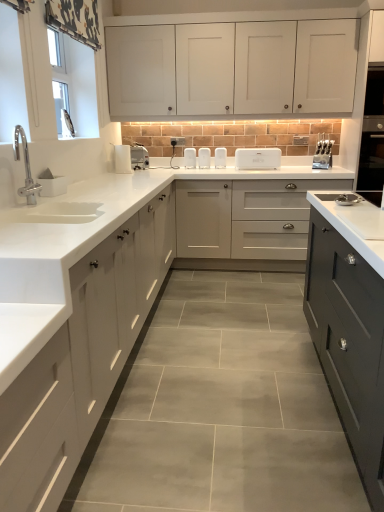
Describe the element at coordinates (323, 153) in the screenshot. This screenshot has width=384, height=512. I see `satin silver knife block at right, positioned as the third appliance in front-to-back order` at that location.

This screenshot has height=512, width=384. What do you see at coordinates (190, 158) in the screenshot?
I see `white glossy toaster at center, marked as the 4th appliance in a left-to-right arrangement` at bounding box center [190, 158].

Describe the element at coordinates (220, 157) in the screenshot. I see `white plastic toaster at center, the sixth appliance viewed from the front` at that location.

Locate an element on the screen. white matte cabinet at upper center, which is the 1th cabinetry in top-to-bottom order is located at coordinates (232, 68).

You are a GUI agent. You are given a task and a screenshot of the screen. Output one action in this format:
    pyautogui.click(x=<x>, y=<y>)
    Task: Click on the white plastic toaster at upper center, the seventh appliance in the back-to-front sequence
    The image size is (384, 512).
    Given the screenshot: What is the action you would take?
    pyautogui.click(x=130, y=158)

Consider the image. Which is less distant, (205, 160) or (136, 158)?

Point (205, 160) is farther from the camera than point (136, 158).

Considering the relative positions of white plastic toaster at center, acting as the 2th appliance starting from the back, and silver metallic toaster at center, acting as the 4th appliance starting from the front, in the image provided, is white plastic toaster at center, acting as the 2th appliance starting from the back, behind silver metallic toaster at center, acting as the 4th appliance starting from the front,?

Yes, the depth of white plastic toaster at center, acting as the 2th appliance starting from the back, is greater than that of silver metallic toaster at center, acting as the 4th appliance starting from the front.

From the image's perspective, which one is positioned lower, white plastic toaster at center, which is counted as the 4th appliance, starting from the right, or silver metallic toaster at center, acting as the 4th appliance starting from the front?

silver metallic toaster at center, acting as the 4th appliance starting from the front, appears lower in the image.

This screenshot has height=512, width=384. Identify the location of the 1st appliance positioned above the silver metallic toaster at center, placed as the third appliance when sorted from left to right (from the image's perspective). (204, 158).

You are a GUI agent. You are given a task and a screenshot of the screen. Output one action in this format:
    pyautogui.click(x=<x>, y=<y>)
    Task: Click on the appliance that is the 3rd object to the right of the white matte cabinet at left, arranged as the first cabinetry when ordered from the bottom, starting at the anchor
    Image resolution: width=384 pixels, height=512 pixels.
    Given the screenshot: What is the action you would take?
    pyautogui.click(x=204, y=158)

Is point (117, 306) closer to viewer compared to point (198, 164)?

Yes.

Is white matte cabinet at left, arranged as the first cabinetry when ordered from the bottom, smaller than white plastic toaster at center, acting as the 2th appliance starting from the back?

Actually, white matte cabinet at left, arranged as the first cabinetry when ordered from the bottom, might be larger than white plastic toaster at center, acting as the 2th appliance starting from the back.

From the image's perspective, which one is positioned lower, white matte cabinet at left, arranged as the first cabinetry when ordered from the bottom, or white plastic toaster at center, which is counted as the 4th appliance, starting from the right?

white matte cabinet at left, arranged as the first cabinetry when ordered from the bottom, is shown below in the image.

Between white plastic toaster at center, placed as the fifth appliance when sorted from left to right, and matte gray cabinet at center, marked as the 2th cabinetry in a bottom-to-top arrangement, which one appears on the right side from the viewer's perspective?

Positioned to the right is matte gray cabinet at center, marked as the 2th cabinetry in a bottom-to-top arrangement.

Is white plastic toaster at center, acting as the 2th appliance starting from the back, in contact with matte gray cabinet at center, the 2th cabinetry positioned from the top?

No, white plastic toaster at center, acting as the 2th appliance starting from the back, is not touching matte gray cabinet at center, the 2th cabinetry positioned from the top.

Which of these two, white plastic toaster at center, acting as the 2th appliance starting from the back, or matte gray cabinet at center, the 2th cabinetry positioned from the top, is bigger?

Bigger between the two is matte gray cabinet at center, the 2th cabinetry positioned from the top.

From a real-world perspective, is white plastic toaster at center, which appears as the 7th appliance when viewed from the front, positioned above or below matte gray cabinet at center, marked as the 2th cabinetry in a bottom-to-top arrangement?

Clearly, from a real-world perspective, white plastic toaster at center, which appears as the 7th appliance when viewed from the front, is above matte gray cabinet at center, marked as the 2th cabinetry in a bottom-to-top arrangement.

The image size is (384, 512). Identify the location of the 4th appliance counting from the left of the white plastic toaster at center, marked as the seventh appliance in a left-to-right arrangement. click(x=139, y=157).

Is silver metallic toaster at center, which ranks as the 6th appliance in right-to-left order, not near white plastic toaster at center, the 2th appliance in the right-to-left sequence?

silver metallic toaster at center, which ranks as the 6th appliance in right-to-left order, is near white plastic toaster at center, the 2th appliance in the right-to-left sequence, not far away.

Is silver metallic toaster at center, the 5th appliance viewed from the back, oriented towards white plastic toaster at center, marked as the seventh appliance in a left-to-right arrangement?

No.

From a real-world perspective, does white glossy countertop at center sit lower than matte gray cabinet at center, marked as the 2th cabinetry in a bottom-to-top arrangement?

No, from a real-world perspective, white glossy countertop at center is not under matte gray cabinet at center, marked as the 2th cabinetry in a bottom-to-top arrangement.

Is white glossy countertop at center directly adjacent to matte gray cabinet at center, the 2th cabinetry positioned from the top?

No, white glossy countertop at center is not touching matte gray cabinet at center, the 2th cabinetry positioned from the top.

Based on the photo, from the image's perspective, between white glossy countertop at center and matte gray cabinet at center, marked as the 2th cabinetry in a bottom-to-top arrangement, who is located below?

From the image's view, white glossy countertop at center is below.

Does point (220, 153) come closer to viewer compared to point (186, 193)?

No, it is behind (186, 193).

How many degrees apart are the facing directions of white plastic toaster at center, placed as the 6th appliance when sorted from left to right, and matte gray cabinet at center, the 2th cabinetry positioned from the top?

The facing directions of white plastic toaster at center, placed as the 6th appliance when sorted from left to right, and matte gray cabinet at center, the 2th cabinetry positioned from the top, are 0.495 degrees apart.

From a real-world perspective, is white plastic toaster at center, placed as the 6th appliance when sorted from left to right, positioned over matte gray cabinet at center, the 2th cabinetry positioned from the top, based on gravity?

Yes, from a real-world perspective, white plastic toaster at center, placed as the 6th appliance when sorted from left to right, is over matte gray cabinet at center, the 2th cabinetry positioned from the top

Which object is positioned more to the right, white matte cabinet at upper center, which is the 1th cabinetry in top-to-bottom order, or satin silver knife block at right, positioned as the third appliance in front-to-back order?

satin silver knife block at right, positioned as the third appliance in front-to-back order, is more to the right.

Is white matte cabinet at upper center, which is the third cabinetry in bottom-to-top order, closer to camera compared to satin silver knife block at right, positioned as the third appliance in front-to-back order?

Yes, it is.

Can you tell me how much white matte cabinet at upper center, which is the third cabinetry in bottom-to-top order, and satin silver knife block at right, marked as the 1th appliance in a right-to-left arrangement, differ in facing direction?

The angle between the facing direction of white matte cabinet at upper center, which is the third cabinetry in bottom-to-top order, and the facing direction of satin silver knife block at right, marked as the 1th appliance in a right-to-left arrangement, is 0.647 degrees.

Which of these two, white matte cabinet at upper center, which is the third cabinetry in bottom-to-top order, or satin silver knife block at right, marked as the 1th appliance in a right-to-left arrangement, stands taller?

With more height is white matte cabinet at upper center, which is the third cabinetry in bottom-to-top order.

At what (x,y) coordinates should I click in order to perform the action: click on the 3rd appliance in front when counting from the white plastic toaster at center, placed as the fifth appliance when sorted from left to right. Please return your answer as a coordinate pair (x, y). The width and height of the screenshot is (384, 512). Looking at the image, I should click on (139, 157).

Where is `cabinetry on the left side of white plastic toaster at center, placed as the fifth appliance when sorted from left to right`? The image size is (384, 512). cabinetry on the left side of white plastic toaster at center, placed as the fifth appliance when sorted from left to right is located at coordinates (82, 358).

When comparing their distances from silver metallic toaster at center, acting as the 4th appliance starting from the front, does white plastic toaster at upper center, marked as the 2th appliance in a left-to-right arrangement, or satin silver knife block at right, placed as the 6th appliance when sorted from back to front, seem further?

Among the two, satin silver knife block at right, placed as the 6th appliance when sorted from back to front, is located further to silver metallic toaster at center, acting as the 4th appliance starting from the front.

Estimate the real-world distances between objects in this image. Which object is further from white plastic toaster at center, positioned as the 4th appliance in back-to-front order, white matte soap dish at left, the first appliance positioned from the left, or white glossy countertop at center?

Based on the image, white glossy countertop at center appears to be further to white plastic toaster at center, positioned as the 4th appliance in back-to-front order.

When comparing their distances from white glossy countertop at center, does matte gray cabinet at center, the 2th cabinetry positioned from the top, or white plastic toaster at center, acting as the 3th appliance starting from the back, seem closer?

matte gray cabinet at center, the 2th cabinetry positioned from the top, is closer to white glossy countertop at center.

From the image, which object appears to be farther from white matte cabinet at left, arranged as the first cabinetry when ordered from the bottom, white plastic toaster at center, which is counted as the 4th appliance, starting from the right, or white matte soap dish at left, the first appliance positioned from the left?

Based on the image, white plastic toaster at center, which is counted as the 4th appliance, starting from the right, appears to be further to white matte cabinet at left, arranged as the first cabinetry when ordered from the bottom.

Based on their spatial positions, is white plastic toaster at center, acting as the 3th appliance starting from the back, or silver metallic toaster at center, which ranks as the 6th appliance in right-to-left order, closer to white glossy countertop at center?

silver metallic toaster at center, which ranks as the 6th appliance in right-to-left order, lies closer to white glossy countertop at center than the other object.

Estimate the real-world distances between objects in this image. Which object is further from white glossy countertop at center, white plastic toaster at center, the sixth appliance viewed from the front, or white plastic toaster at center, which ranks as the 5th appliance in front-to-back order?

white plastic toaster at center, the sixth appliance viewed from the front, is positioned further to the anchor white glossy countertop at center.

Looking at the image, which one is located closer to white glossy countertop at center, white plastic toaster at upper center, the seventh appliance in the back-to-front sequence, or silver metallic toaster at center, placed as the third appliance when sorted from left to right?

white plastic toaster at upper center, the seventh appliance in the back-to-front sequence, lies closer to white glossy countertop at center than the other object.

From the image, which object appears to be nearer to satin silver knife block at right, the 8th appliance in the left-to-right sequence, white plastic toaster at center, which appears as the 7th appliance when viewed from the front, or white glossy toaster at center, placed as the 8th appliance when sorted from front to back?

white plastic toaster at center, which appears as the 7th appliance when viewed from the front.

At what (x,y) coordinates should I click in order to perform the action: click on appliance between white plastic toaster at upper center, which appears as the 2th appliance when viewed from the front, and white glossy toaster at center, placed as the 8th appliance when sorted from front to back, in the horizontal direction. Please return your answer as a coordinate pair (x, y). The image size is (384, 512). Looking at the image, I should click on (139, 157).

The image size is (384, 512). I want to click on appliance located between white plastic toaster at center, which appears as the 7th appliance when viewed from the front, and white plastic toaster at center, the 2th appliance in the right-to-left sequence, in the left-right direction, so (x=220, y=157).

Locate an element on the screen. This screenshot has width=384, height=512. appliance between white matte cabinet at upper center, which is the 1th cabinetry in top-to-bottom order, and satin silver knife block at right, placed as the 6th appliance when sorted from back to front is located at coordinates (257, 158).

I want to click on appliance between white glossy countertop at center and white plastic toaster at upper center, the seventh appliance in the back-to-front sequence, from front to back, so click(x=51, y=184).